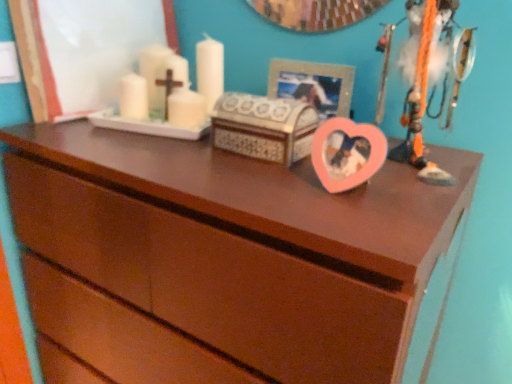
Question: Is pink plastic heart at upper right positioned before brown wood chest of drawers at center?

Choices:
 (A) yes
 (B) no

Answer: (B)

Question: From the image's perspective, is pink plastic heart at upper right located beneath brown wood chest of drawers at center?

Choices:
 (A) no
 (B) yes

Answer: (A)

Question: Can you confirm if pink plastic heart at upper right is positioned to the right of brown wood chest of drawers at center?

Choices:
 (A) yes
 (B) no

Answer: (A)

Question: Can you confirm if pink plastic heart at upper right is taller than brown wood chest of drawers at center?

Choices:
 (A) no
 (B) yes

Answer: (A)

Question: Considering the relative positions of pink plastic heart at upper right and brown wood chest of drawers at center in the image provided, is pink plastic heart at upper right to the left of brown wood chest of drawers at center from the viewer's perspective?

Choices:
 (A) no
 (B) yes

Answer: (A)

Question: From the image's perspective, relative to pink plastic heart at upper right, is brown wood chest of drawers at center above or below?

Choices:
 (A) below
 (B) above

Answer: (A)

Question: Is brown wood chest of drawers at center bigger or smaller than pink plastic heart at upper right?

Choices:
 (A) small
 (B) big

Answer: (B)

Question: From a real-world perspective, is brown wood chest of drawers at center physically located above or below pink plastic heart at upper right?

Choices:
 (A) below
 (B) above

Answer: (A)

Question: Does point (245, 258) appear closer or farther from the camera than point (424, 170)?

Choices:
 (A) closer
 (B) farther

Answer: (A)

Question: In terms of width, does metallic silver picture frame at upper center look wider or thinner when compared to brown wood chest of drawers at center?

Choices:
 (A) thin
 (B) wide

Answer: (A)

Question: Looking at the image, does metallic silver picture frame at upper center seem bigger or smaller compared to brown wood chest of drawers at center?

Choices:
 (A) big
 (B) small

Answer: (B)

Question: In the image, is metallic silver picture frame at upper center positioned in front of or behind brown wood chest of drawers at center?

Choices:
 (A) behind
 (B) front

Answer: (A)

Question: From their relative heights in the image, would you say metallic silver picture frame at upper center is taller or shorter than brown wood chest of drawers at center?

Choices:
 (A) tall
 (B) short

Answer: (B)

Question: Considering the positions of brown wood chest of drawers at center and metallic silver picture frame at upper center in the image, is brown wood chest of drawers at center bigger or smaller than metallic silver picture frame at upper center?

Choices:
 (A) small
 (B) big

Answer: (B)

Question: Is brown wood chest of drawers at center in front of or behind metallic silver picture frame at upper center in the image?

Choices:
 (A) front
 (B) behind

Answer: (A)